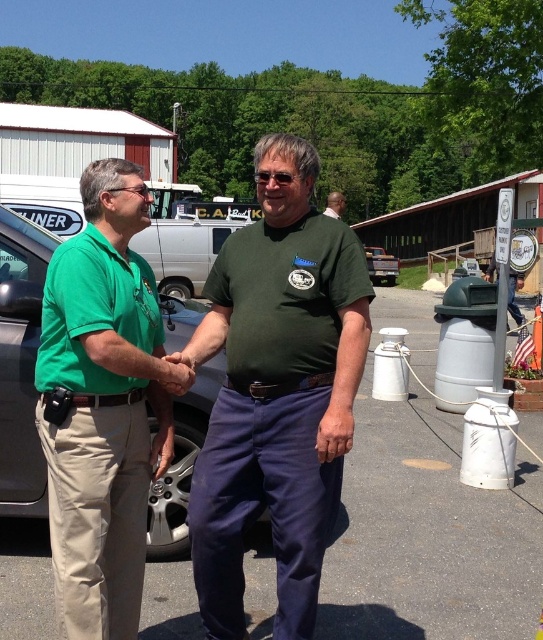
You are standing in the scene and want to know which object is taller between the brushed metal truck at center and the green shirt at center. Can you determine this based on their positions?

The green shirt at center is taller than the brushed metal truck at center according to the description.

You are standing in the scene and want to take a photo of the brushed metal truck at center and the green shirt at center. Which object should you focus on first to ensure it appears sharp in the photo?

You should focus on the brushed metal truck at center first because it is closer to you than the green shirt at center, so focusing on it will keep both objects in focus if they are within the depth of field.